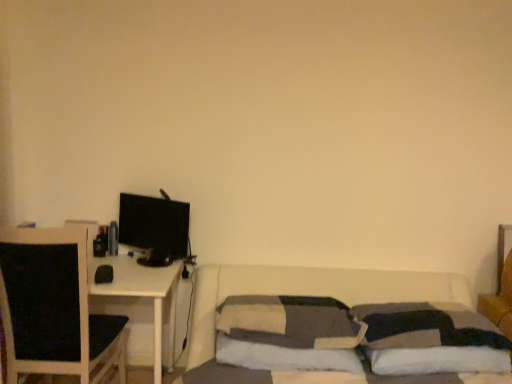
Question: Is soft gray fabric pillow at center, positioned as the second pillow in left-to-right order, positioned before black fabric chair at left?

Choices:
 (A) yes
 (B) no

Answer: (A)

Question: Considering the relative sizes of soft gray fabric pillow at center, positioned as the second pillow in left-to-right order, and black fabric chair at left in the image provided, is soft gray fabric pillow at center, positioned as the second pillow in left-to-right order, bigger than black fabric chair at left?

Choices:
 (A) no
 (B) yes

Answer: (A)

Question: Is soft gray fabric pillow at center, positioned as the second pillow in right-to-left order, smaller than black fabric chair at left?

Choices:
 (A) yes
 (B) no

Answer: (A)

Question: Does soft gray fabric pillow at center, positioned as the second pillow in right-to-left order, have a lesser width compared to black fabric chair at left?

Choices:
 (A) yes
 (B) no

Answer: (A)

Question: Would you say soft gray fabric pillow at center, positioned as the second pillow in right-to-left order, is outside black fabric chair at left?

Choices:
 (A) no
 (B) yes

Answer: (B)

Question: Considering the positions of textured gray pillow at center, the 1th pillow in the left-to-right sequence, and white soft pillow at lower right, acting as the 1th pillow starting from the right, in the image, is textured gray pillow at center, the 1th pillow in the left-to-right sequence, wider or thinner than white soft pillow at lower right, acting as the 1th pillow starting from the right,?

Choices:
 (A) thin
 (B) wide

Answer: (B)

Question: Is point (323, 309) positioned closer to the camera than point (435, 311)?

Choices:
 (A) farther
 (B) closer

Answer: (A)

Question: Considering the positions of textured gray pillow at center, the 1th pillow in the left-to-right sequence, and white soft pillow at lower right, acting as the 1th pillow starting from the right, in the image, is textured gray pillow at center, the 1th pillow in the left-to-right sequence, taller or shorter than white soft pillow at lower right, acting as the 1th pillow starting from the right,?

Choices:
 (A) short
 (B) tall

Answer: (B)

Question: Relative to white soft pillow at lower right, the third pillow when ordered from left to right, is textured gray pillow at center, the 1th pillow in the left-to-right sequence, in front or behind?

Choices:
 (A) behind
 (B) front

Answer: (A)

Question: Based on their positions, is textured gray pillow at center, arranged as the 3th pillow when viewed from the right, located to the left or right of black glossy monitor at left?

Choices:
 (A) right
 (B) left

Answer: (A)

Question: Considering the positions of textured gray pillow at center, the 1th pillow in the left-to-right sequence, and black glossy monitor at left in the image, is textured gray pillow at center, the 1th pillow in the left-to-right sequence, wider or thinner than black glossy monitor at left?

Choices:
 (A) thin
 (B) wide

Answer: (B)

Question: Do you think textured gray pillow at center, arranged as the 3th pillow when viewed from the right, is within black glossy monitor at left, or outside of it?

Choices:
 (A) outside
 (B) inside

Answer: (A)

Question: From the image's perspective, is textured gray pillow at center, the 1th pillow in the left-to-right sequence, positioned above or below black glossy monitor at left?

Choices:
 (A) below
 (B) above

Answer: (A)

Question: Considering the relative positions of black fabric chair at left and white soft pillow at lower right, acting as the 1th pillow starting from the right, in the image provided, is black fabric chair at left to the left or to the right of white soft pillow at lower right, acting as the 1th pillow starting from the right,?

Choices:
 (A) right
 (B) left

Answer: (B)

Question: Looking at the image, does black fabric chair at left seem bigger or smaller compared to white soft pillow at lower right, acting as the 1th pillow starting from the right?

Choices:
 (A) small
 (B) big

Answer: (B)